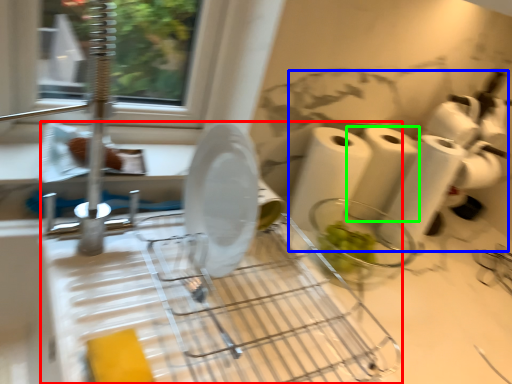
Question: Estimate the real-world distances between objects in this image. Which object is closer to appliance (highlighted by a red box), toilet paper (highlighted by a blue box) or paper towel (highlighted by a green box)?

Choices:
 (A) toilet paper
 (B) paper towel

Answer: (B)